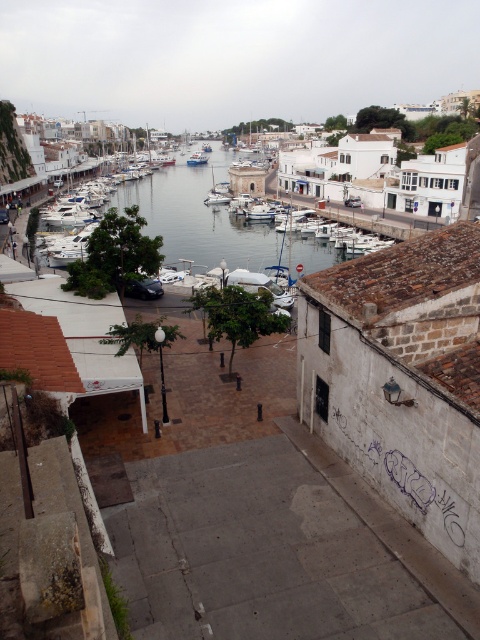
Does white matte boat at center have a lesser width compared to white glossy boat at center?

Yes.

Between white matte boat at center and white glossy boat at center, which one appears on the left side from the viewer's perspective?

white glossy boat at center

Measure the distance between point (x=266, y=218) and camera.

86.81 meters

The height and width of the screenshot is (640, 480). Find the location of `white matte boat at center`. white matte boat at center is located at coordinates (260, 212).